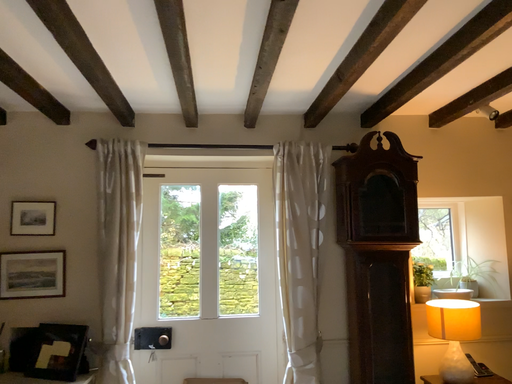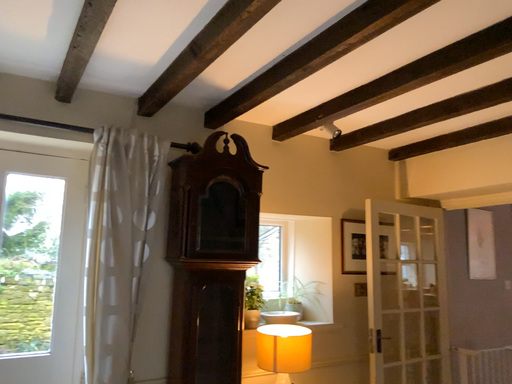
Question: Which way did the camera rotate in the video?

Choices:
 (A) rotated right
 (B) rotated left

Answer: (A)